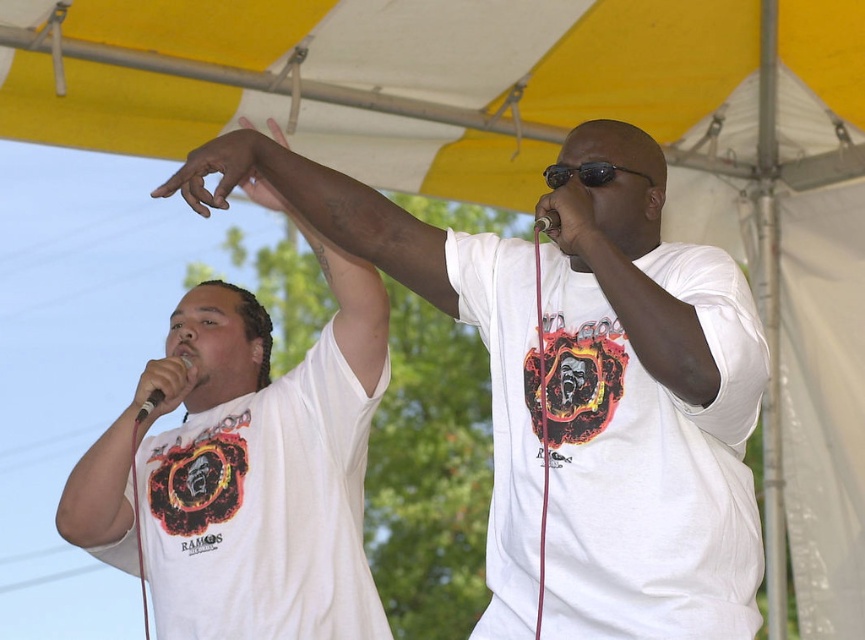
Who is higher up, white matte t-shirt at left or white plastic microphone at upper left?

white matte t-shirt at left is above.

This screenshot has height=640, width=865. What are the coordinates of `white matte t-shirt at left` in the screenshot? It's located at (248, 465).

Is point (130, 417) positioned in front of point (183, 362)?

That is True.

I want to click on white matte t-shirt at left, so click(x=248, y=465).